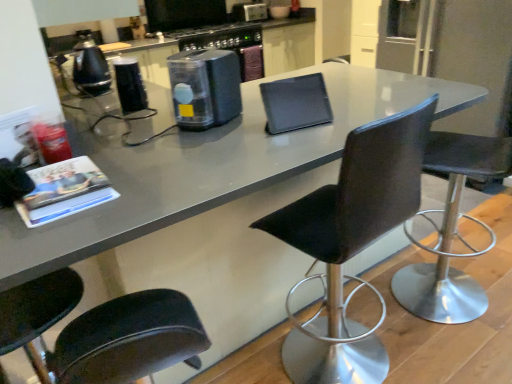
Question: Is transparent plastic container at center, marked as the 3th appliance in a top-to-bottom arrangement, aimed at metallic silver toaster at upper center, arranged as the third appliance when viewed from the front?

Choices:
 (A) yes
 (B) no

Answer: (A)

Question: From the image's perspective, is transparent plastic container at center, acting as the first appliance starting from the front, beneath metallic silver toaster at upper center, placed as the 1th appliance when sorted from top to bottom?

Choices:
 (A) no
 (B) yes

Answer: (B)

Question: Is transparent plastic container at center, which is the first appliance from bottom to top, bigger than metallic silver toaster at upper center, the first appliance in the right-to-left sequence?

Choices:
 (A) no
 (B) yes

Answer: (B)

Question: Would you consider transparent plastic container at center, marked as the second appliance in a right-to-left arrangement, to be distant from metallic silver toaster at upper center, the first appliance in the right-to-left sequence?

Choices:
 (A) no
 (B) yes

Answer: (B)

Question: Considering the relative positions of transparent plastic container at center, marked as the second appliance in a right-to-left arrangement, and metallic silver toaster at upper center, the 3th appliance positioned from the left, in the image provided, is transparent plastic container at center, marked as the second appliance in a right-to-left arrangement, behind metallic silver toaster at upper center, the 3th appliance positioned from the left,?

Choices:
 (A) no
 (B) yes

Answer: (A)

Question: Visually, is black leather chair at lower left, the first chair in the left-to-right sequence, positioned to the left or to the right of transparent plastic container at center, acting as the first appliance starting from the front?

Choices:
 (A) right
 (B) left

Answer: (B)

Question: Relative to transparent plastic container at center, marked as the 3th appliance in a top-to-bottom arrangement, is black leather chair at lower left, the first chair in the left-to-right sequence, in front or behind?

Choices:
 (A) behind
 (B) front

Answer: (B)

Question: Is black leather chair at lower left, marked as the third chair in a right-to-left arrangement, taller or shorter than transparent plastic container at center, marked as the second appliance in a right-to-left arrangement?

Choices:
 (A) tall
 (B) short

Answer: (A)

Question: From a real-world perspective, is black leather chair at lower left, the first chair in the left-to-right sequence, above or below transparent plastic container at center, marked as the 3th appliance in a top-to-bottom arrangement?

Choices:
 (A) above
 (B) below

Answer: (B)

Question: Is black leather chair at lower left, the first chair in the left-to-right sequence, to the left or to the right of black glossy kettle at left, which is counted as the second appliance, starting from the front, in the image?

Choices:
 (A) right
 (B) left

Answer: (A)

Question: From a real-world perspective, is black leather chair at lower left, the first chair in the left-to-right sequence, positioned above or below black glossy kettle at left, the 2th appliance viewed from the top?

Choices:
 (A) above
 (B) below

Answer: (B)

Question: Is black leather chair at lower left, marked as the third chair in a right-to-left arrangement, taller or shorter than black glossy kettle at left, which ranks as the third appliance in right-to-left order?

Choices:
 (A) tall
 (B) short

Answer: (A)

Question: Considering the positions of point (80, 362) and point (102, 54), is point (80, 362) closer or farther from the camera than point (102, 54)?

Choices:
 (A) closer
 (B) farther

Answer: (A)

Question: Considering the positions of black leather chair at right, the third chair from the left, and matte black magazine at left in the image, is black leather chair at right, the third chair from the left, wider or thinner than matte black magazine at left?

Choices:
 (A) thin
 (B) wide

Answer: (B)

Question: From a real-world perspective, is black leather chair at right, the third chair from the left, physically located above or below matte black magazine at left?

Choices:
 (A) below
 (B) above

Answer: (A)